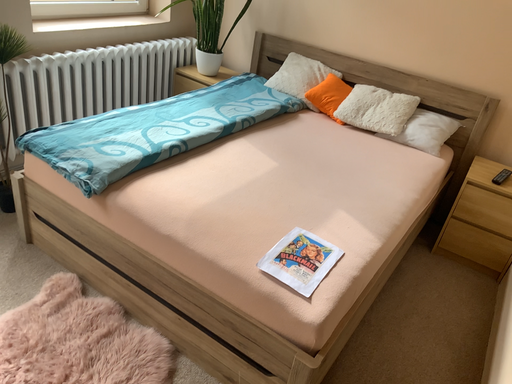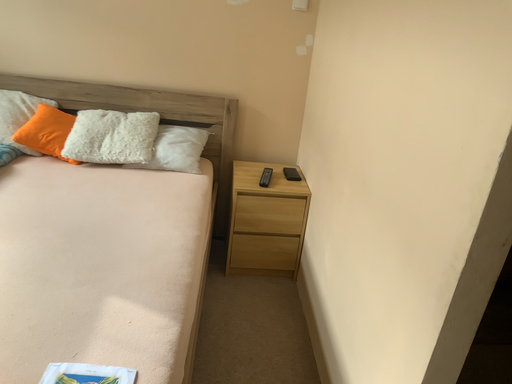
Question: How did the camera likely rotate when shooting the video?

Choices:
 (A) rotated left
 (B) rotated right

Answer: (B)